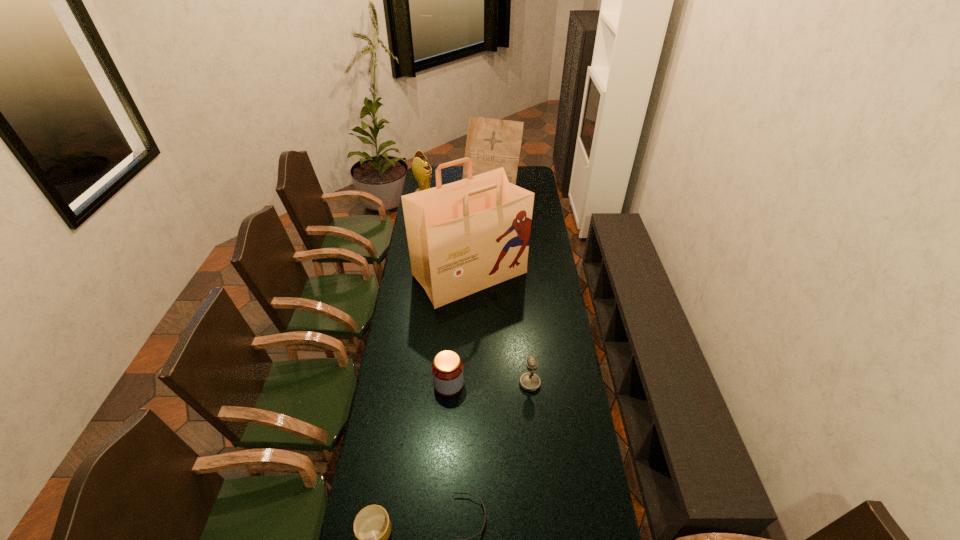
Locate an element on the screen. Image resolution: width=960 pixels, height=540 pixels. vacant space at the right edge of the desktop is located at coordinates (548, 264).

This screenshot has height=540, width=960. I want to click on unoccupied position between the award and the microphone, so click(477, 293).

You are a GUI agent. You are given a task and a screenshot of the screen. Output one action in this format:
    pyautogui.click(x=<x>, y=<y>)
    Task: Click on the empty space between the farther grocery bag and the microphone
    
    Given the screenshot: What is the action you would take?
    pyautogui.click(x=511, y=285)

At what (x,y) coordinates should I click in order to perform the action: click on empty space that is in between the jar and the nearer grocery bag. Please return your answer as a coordinate pair (x, y). The height and width of the screenshot is (540, 960). Looking at the image, I should click on (459, 329).

Select which object appears as the third closest to the sixth shortest object. Please provide its 2D coordinates. Your answer should be formatted as a tuple, i.e. [(x, y)], where the tuple contains the x and y coordinates of a point satisfying the conditions above.

[(447, 368)]

Point out which object is positioned as the nearest to the fifth shortest object. Please provide its 2D coordinates. Your answer should be formatted as a tuple, i.e. [(x, y)], where the tuple contains the x and y coordinates of a point satisfying the conditions above.

[(491, 143)]

You are a GUI agent. You are given a task and a screenshot of the screen. Output one action in this format:
    pyautogui.click(x=<x>, y=<y>)
    Task: Click on the blank area in the image that satisfies the following two spatial constraints: 1. on the back side of the jar; 2. on the front-facing side of the third tallest object
    
    Given the screenshot: What is the action you would take?
    pyautogui.click(x=460, y=202)

The height and width of the screenshot is (540, 960). What are the coordinates of `vacant space that satisfies the following two spatial constraints: 1. on the front side of the farther grocery bag; 2. on the front-facing side of the award` in the screenshot? It's located at (492, 202).